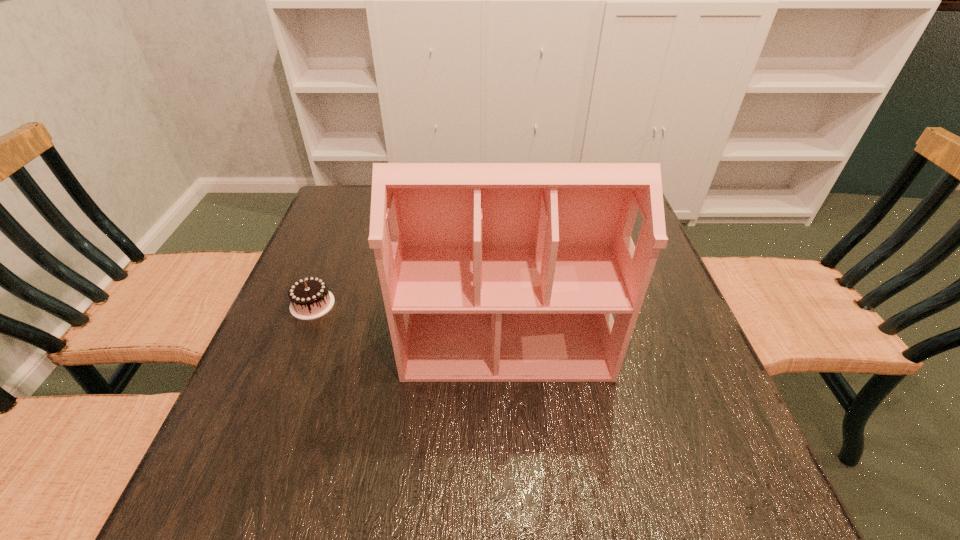
The image size is (960, 540). In the image, there is a desktop. In order to click on blank space at the far left corner in this screenshot , I will do `click(354, 196)`.

The height and width of the screenshot is (540, 960). In order to click on vacant area at the near right corner of the desktop in this screenshot , I will do `click(710, 514)`.